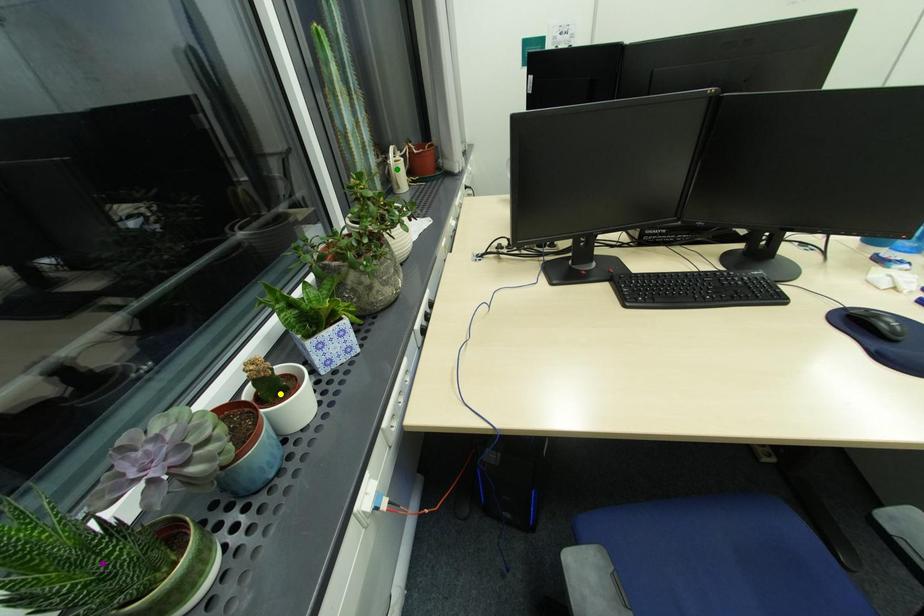
Order these from nearest to farthest:
green point
purple point
yellow point

purple point, yellow point, green point